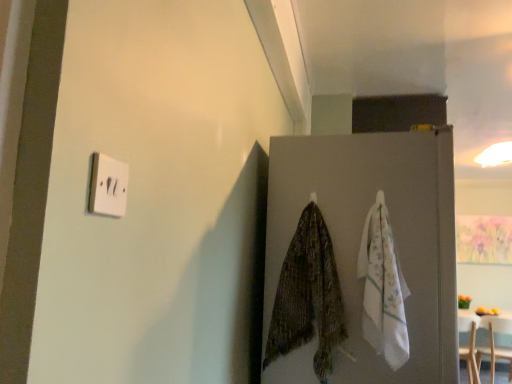
Question: Is gray matte refrigerator at center wider than wooden table at lower right?

Choices:
 (A) no
 (B) yes

Answer: (B)

Question: Is gray matte refrigerator at center turned away from wooden table at lower right?

Choices:
 (A) no
 (B) yes

Answer: (A)

Question: Does gray matte refrigerator at center appear on the left side of wooden table at lower right?

Choices:
 (A) yes
 (B) no

Answer: (A)

Question: Does gray matte refrigerator at center lie behind wooden table at lower right?

Choices:
 (A) no
 (B) yes

Answer: (A)

Question: Is gray matte refrigerator at center surrounding wooden table at lower right?

Choices:
 (A) no
 (B) yes

Answer: (A)

Question: Which is correct: white cotton towel at right is inside wooden table at lower right, or outside of it?

Choices:
 (A) outside
 (B) inside

Answer: (A)

Question: In terms of height, does white cotton towel at right look taller or shorter compared to wooden table at lower right?

Choices:
 (A) tall
 (B) short

Answer: (B)

Question: From a real-world perspective, is white cotton towel at right positioned above or below wooden table at lower right?

Choices:
 (A) below
 (B) above

Answer: (B)

Question: Visually, is white cotton towel at right positioned to the left or to the right of wooden table at lower right?

Choices:
 (A) right
 (B) left

Answer: (B)

Question: Is white plastic light switch at upper left spatially inside gray matte refrigerator at center, or outside of it?

Choices:
 (A) outside
 (B) inside

Answer: (A)

Question: From the image's perspective, relative to gray matte refrigerator at center, is white plastic light switch at upper left above or below?

Choices:
 (A) above
 (B) below

Answer: (A)

Question: In the image, is white plastic light switch at upper left positioned in front of or behind gray matte refrigerator at center?

Choices:
 (A) behind
 (B) front

Answer: (B)

Question: In terms of height, does white plastic light switch at upper left look taller or shorter compared to gray matte refrigerator at center?

Choices:
 (A) tall
 (B) short

Answer: (B)

Question: Considering the positions of wooden table at lower right and gray matte refrigerator at center in the image, is wooden table at lower right bigger or smaller than gray matte refrigerator at center?

Choices:
 (A) big
 (B) small

Answer: (B)

Question: Visually, is wooden table at lower right positioned to the left or to the right of gray matte refrigerator at center?

Choices:
 (A) left
 (B) right

Answer: (B)